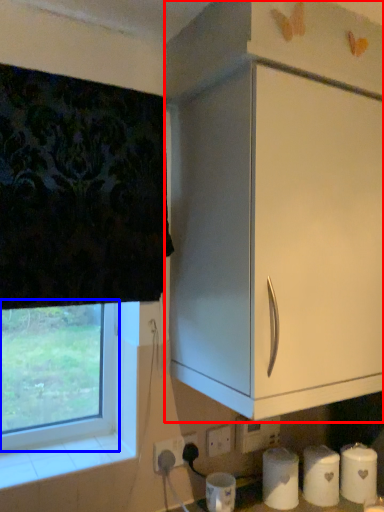
Question: Among these objects, which one is farthest to the camera, cabinetry (highlighted by a red box) or window (highlighted by a blue box)?

Choices:
 (A) cabinetry
 (B) window

Answer: (B)